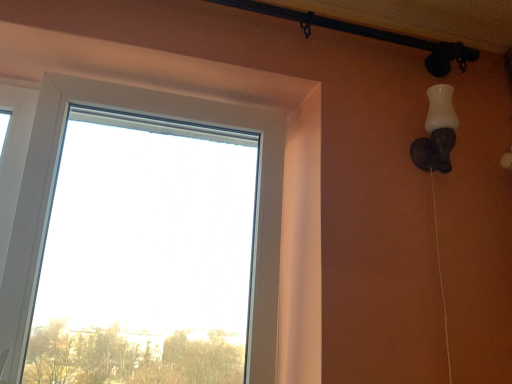
Question: Is white matte lamp at upper right located within transparent glass window at center?

Choices:
 (A) yes
 (B) no

Answer: (B)

Question: From the image's perspective, is transparent glass window at center over white matte lamp at upper right?

Choices:
 (A) no
 (B) yes

Answer: (A)

Question: Does transparent glass window at center have a lesser height compared to white matte lamp at upper right?

Choices:
 (A) no
 (B) yes

Answer: (A)

Question: From a real-world perspective, is transparent glass window at center below white matte lamp at upper right?

Choices:
 (A) no
 (B) yes

Answer: (B)

Question: Is transparent glass window at center touching white matte lamp at upper right?

Choices:
 (A) no
 (B) yes

Answer: (A)

Question: Does transparent glass window at center come in front of white matte lamp at upper right?

Choices:
 (A) no
 (B) yes

Answer: (B)

Question: Is white matte lamp at upper right bigger than transparent glass window at center?

Choices:
 (A) no
 (B) yes

Answer: (A)

Question: Does white matte lamp at upper right have a greater width compared to transparent glass window at center?

Choices:
 (A) no
 (B) yes

Answer: (A)

Question: Is white matte lamp at upper right turned away from transparent glass window at center?

Choices:
 (A) no
 (B) yes

Answer: (A)

Question: Does white matte lamp at upper right appear on the right side of transparent glass window at center?

Choices:
 (A) yes
 (B) no

Answer: (A)

Question: Is white matte lamp at upper right aimed at transparent glass window at center?

Choices:
 (A) yes
 (B) no

Answer: (B)

Question: Does white matte lamp at upper right have a greater height compared to transparent glass window at center?

Choices:
 (A) yes
 (B) no

Answer: (B)

Question: From the image's perspective, is white matte lamp at upper right positioned above or below transparent glass window at center?

Choices:
 (A) above
 (B) below

Answer: (A)